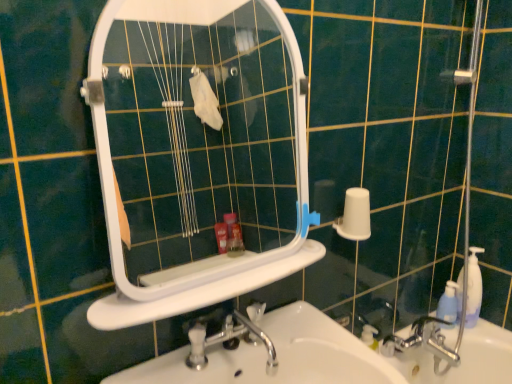
Question: Considering the positions of white plastic mirror at upper center and white glossy sink at lower center in the image, is white plastic mirror at upper center bigger or smaller than white glossy sink at lower center?

Choices:
 (A) small
 (B) big

Answer: (A)

Question: Does point (137, 172) appear closer or farther from the camera than point (478, 322)?

Choices:
 (A) farther
 (B) closer

Answer: (A)

Question: Which of these objects is positioned closest to the white plastic mirror at upper center?

Choices:
 (A) white plastic ledge at center
 (B) white glossy sink at lower center
 (C) white matte toilet paper at right
 (D) blue translucent bottle at right
 (E) translucent plastic soap dispenser at right

Answer: (A)

Question: Which is nearer to the white matte toilet paper at right?

Choices:
 (A) translucent plastic soap dispenser at right
 (B) white glossy sink at lower center
 (C) silver metallic faucet at lower right
 (D) white plastic ledge at center
 (E) white plastic mirror at upper center

Answer: (D)